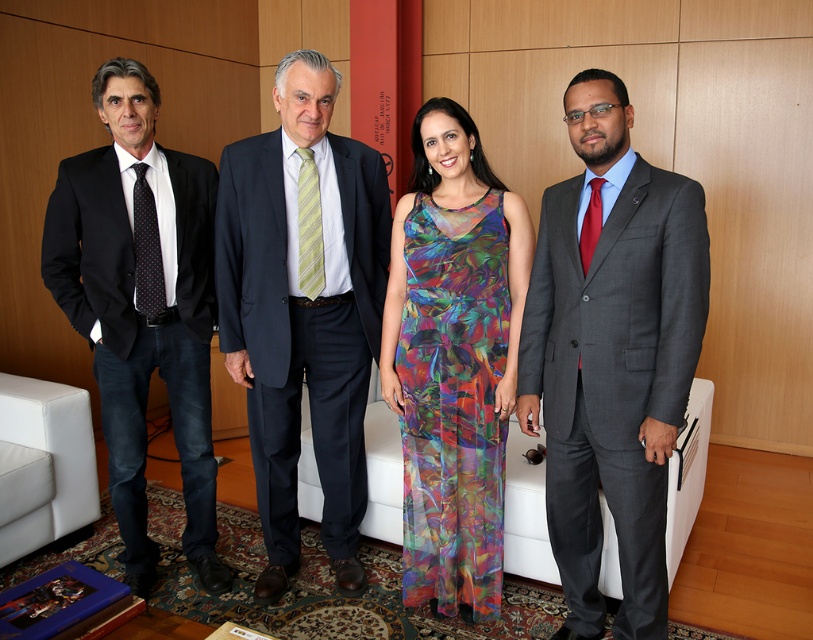
You are standing in the room and want to move from point A to point B. Point A is at coordinates point (244, 384) and point B is at coordinates point (146, 253). Which point is closer to you?

Point (244, 384) is closer to you because it is further to the viewer than point (146, 253).

You are a photographer setting up for a group photo. You want to ensure there is enough space between the gray suit at right and the multicolored chiffon dress at center for a professional look. The photography guideline recommends at least 10 inches between subjects. Can you confirm if the current spacing meets this requirement?

The gray suit at right and multicolored chiffon dress at center are 12.71 inches apart, which exceeds the recommended 10 inches. The spacing is sufficient for a professional look.